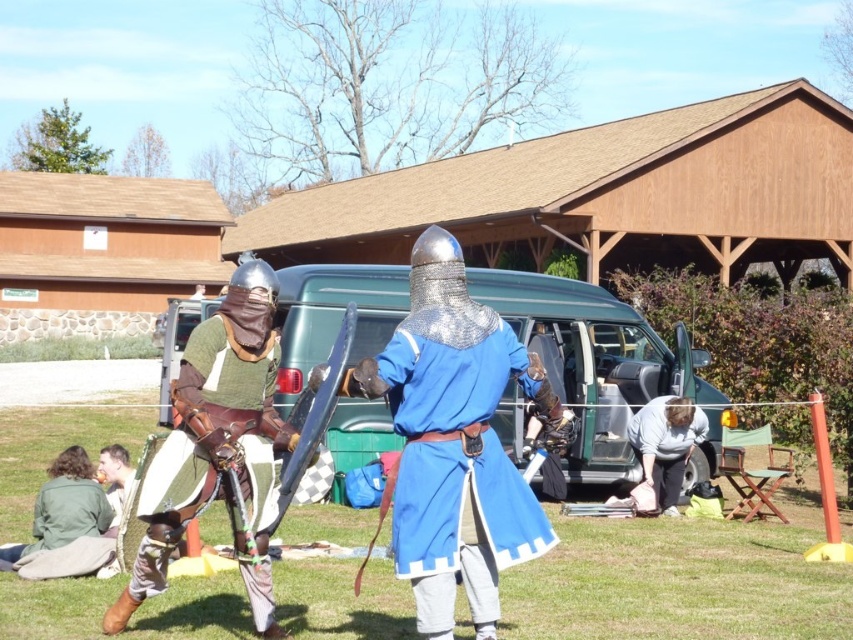
Question: From the image, what is the correct spatial relationship of metallic chainmail armor at center in relation to green leather armor at center?

Choices:
 (A) below
 (B) above

Answer: (B)

Question: Is metallic chainmail armor at center smaller than green fabric jacket at lower left?

Choices:
 (A) no
 (B) yes

Answer: (A)

Question: Estimate the real-world distances between objects in this image. Which object is closer to the green fabric jacket at lower left?

Choices:
 (A) green leather armor at center
 (B) metallic chainmail armor at center

Answer: (A)

Question: Which object appears closest to the camera in this image?

Choices:
 (A) gray fabric bag at lower right
 (B) green fabric jacket at lower left
 (C) green leather armor at center
 (D) metallic chainmail armor at center

Answer: (D)

Question: Does gray fabric bag at lower right have a lesser width compared to green fabric jacket at lower left?

Choices:
 (A) no
 (B) yes

Answer: (B)

Question: Estimate the real-world distances between objects in this image. Which object is farther from the green leather armor at center?

Choices:
 (A) green fabric jacket at lower left
 (B) gray fabric bag at lower right

Answer: (B)